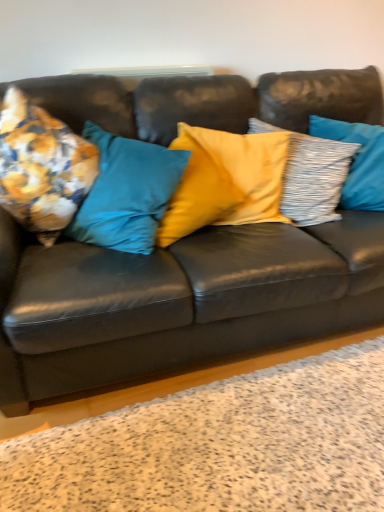
Question: From a real-world perspective, relative to yellow satin pillow at center, the second pillow positioned from the right, is matte black couch at center vertically above or below?

Choices:
 (A) above
 (B) below

Answer: (B)

Question: In terms of height, does matte black couch at center look taller or shorter compared to yellow satin pillow at center, arranged as the 3th pillow when viewed from the left?

Choices:
 (A) short
 (B) tall

Answer: (B)

Question: Which of these objects is positioned closest to the floral fabric cushion at left, which is counted as the first pillow, starting from the left?

Choices:
 (A) floral fabric cushion at left, the 2th pillow from the left
 (B) matte black couch at center
 (C) yellow satin pillow at center, arranged as the 3th pillow when viewed from the left
 (D) textured gray pillow at right, marked as the first pillow in a right-to-left arrangement

Answer: (A)

Question: Estimate the real-world distances between objects in this image. Which object is farther from the yellow satin pillow at center, the second pillow positioned from the right?

Choices:
 (A) floral fabric cushion at left, the 3th pillow positioned from the right
 (B) matte black couch at center
 (C) textured gray pillow at right, marked as the first pillow in a right-to-left arrangement
 (D) floral fabric cushion at left, which is counted as the first pillow, starting from the left

Answer: (D)